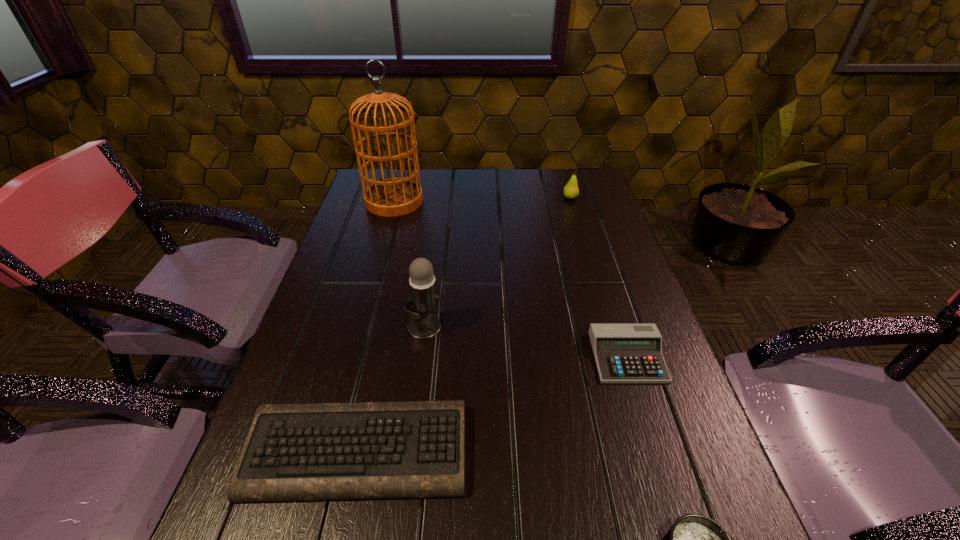
In the image, there is a desktop. Where is `free space at the right edge`? free space at the right edge is located at coordinates (671, 363).

I want to click on vacant space at the far right corner, so click(x=565, y=174).

I want to click on unoccupied position between the computer keyboard and the calculator, so click(492, 404).

The image size is (960, 540). In order to click on vacant space that's between the third tallest object and the tallest object in this screenshot , I will do `click(482, 199)`.

Identify the location of free space between the calculator and the birdcage. (511, 279).

Locate an element on the screen. The width and height of the screenshot is (960, 540). vacant area between the third tallest object and the computer keyboard is located at coordinates (464, 325).

Locate an element on the screen. vacant region between the microphone and the tallest object is located at coordinates (409, 264).

Locate an element on the screen. free spot between the birdcage and the calculator is located at coordinates (511, 279).

Locate an element on the screen. This screenshot has height=540, width=960. the fourth closest object to the calculator is located at coordinates tap(571, 191).

Point out which object is positioned as the second nearest to the ashtray. Please provide its 2D coordinates. Your answer should be formatted as a tuple, i.e. [(x, y)], where the tuple contains the x and y coordinates of a point satisfying the conditions above.

[(372, 450)]